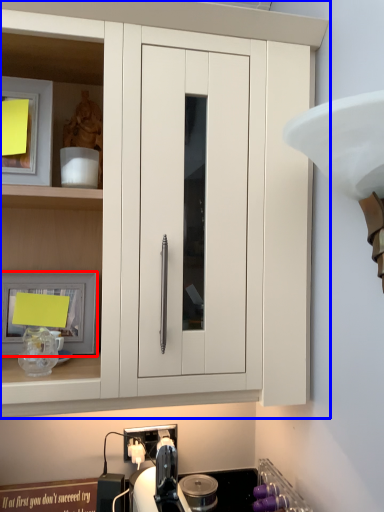
Question: Which object is further to the camera taking this photo, picture frame (highlighted by a red box) or cabinetry (highlighted by a blue box)?

Choices:
 (A) picture frame
 (B) cabinetry

Answer: (A)